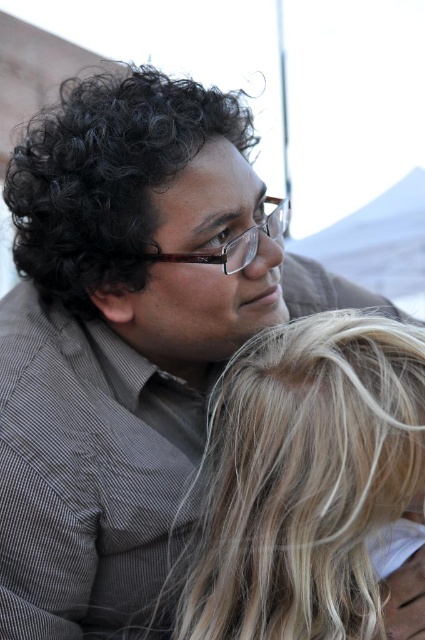
This screenshot has height=640, width=425. What do you see at coordinates (302, 481) in the screenshot? I see `blonde hair at center` at bounding box center [302, 481].

Does blonde hair at center come behind black curly hair at upper left?

No, it is in front of black curly hair at upper left.

The image size is (425, 640). In order to click on blonde hair at center in this screenshot , I will do `click(302, 481)`.